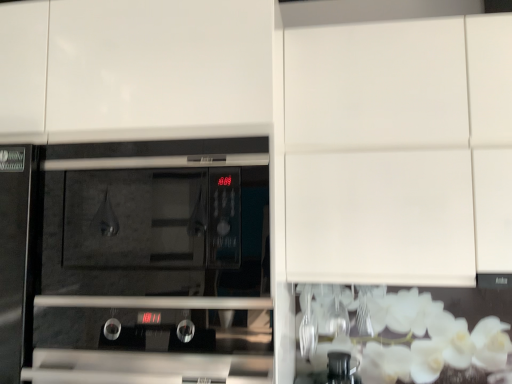
Question: Considering the relative positions of black glass oven at center and white matte cabinet at upper center in the image provided, is black glass oven at center to the right of white matte cabinet at upper center from the viewer's perspective?

Choices:
 (A) no
 (B) yes

Answer: (A)

Question: Can you confirm if black glass oven at center is bigger than white matte cabinet at upper center?

Choices:
 (A) no
 (B) yes

Answer: (A)

Question: From a real-world perspective, is black glass oven at center positioned under white matte cabinet at upper center based on gravity?

Choices:
 (A) yes
 (B) no

Answer: (A)

Question: From a real-world perspective, is black glass oven at center positioned over white matte cabinet at upper center based on gravity?

Choices:
 (A) no
 (B) yes

Answer: (A)

Question: Can you confirm if black glass oven at center is positioned to the left of white matte cabinet at upper center?

Choices:
 (A) yes
 (B) no

Answer: (A)

Question: Does black glass oven at center lie behind white matte cabinet at upper center?

Choices:
 (A) yes
 (B) no

Answer: (B)

Question: Considering the relative sizes of white matte cabinet at upper center and black glass oven at center in the image provided, is white matte cabinet at upper center wider than black glass oven at center?

Choices:
 (A) yes
 (B) no

Answer: (A)

Question: Is white matte cabinet at upper center positioned in front of black glass oven at center?

Choices:
 (A) yes
 (B) no

Answer: (B)

Question: Is white matte cabinet at upper center taller than black glass oven at center?

Choices:
 (A) yes
 (B) no

Answer: (A)

Question: Is black glass oven at center at the back of white matte cabinet at upper center?

Choices:
 (A) no
 (B) yes

Answer: (A)

Question: Does white matte cabinet at upper center have a lesser width compared to black glass oven at center?

Choices:
 (A) yes
 (B) no

Answer: (B)

Question: Does white matte cabinet at upper center appear on the right side of black glass oven at center?

Choices:
 (A) no
 (B) yes

Answer: (B)

Question: Is black glass oven at center bigger or smaller than white matte cabinet at upper center?

Choices:
 (A) big
 (B) small

Answer: (B)